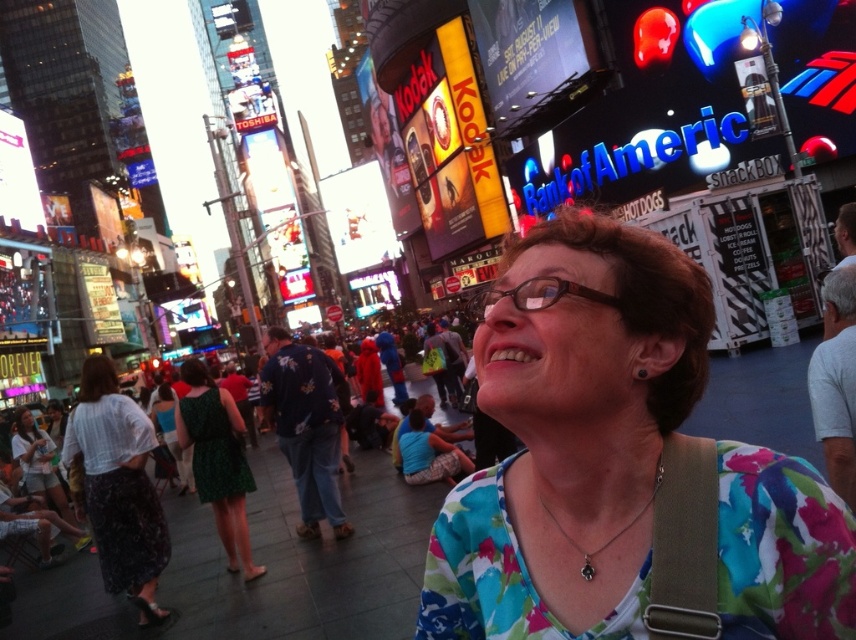
Which is above, green dotted dress at center or matte white shirt at lower left?

green dotted dress at center is above.

Is green dotted dress at center thinner than matte white shirt at lower left?

No, green dotted dress at center is not thinner than matte white shirt at lower left.

Where is `green dotted dress at center`? The width and height of the screenshot is (856, 640). green dotted dress at center is located at coordinates (217, 461).

Is green textured dress at left below green dotted dress at center?

Yes.

Between green textured dress at left and green dotted dress at center, which one appears on the left side from the viewer's perspective?

From the viewer's perspective, green textured dress at left appears more on the left side.

This screenshot has width=856, height=640. Describe the element at coordinates (117, 486) in the screenshot. I see `green textured dress at left` at that location.

I want to click on green textured dress at left, so click(117, 486).

Who is more distant from viewer, (660, 403) or (316, 592)?

Positioned behind is point (316, 592).

Does point (642, 236) come closer to viewer compared to point (278, 536)?

Yes, it is.

Between point (539, 451) and point (413, 534), which one is positioned behind?

Positioned behind is point (413, 534).

Locate an element on the screen. floral fabric blouse at center is located at coordinates (623, 467).